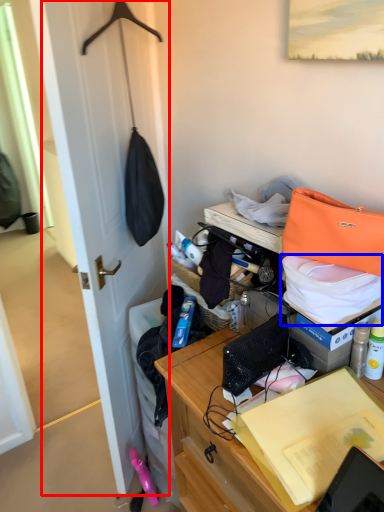
Question: Which of the following is the farthest to the observer, door (highlighted by a red box) or kit (highlighted by a blue box)?

Choices:
 (A) door
 (B) kit

Answer: (A)